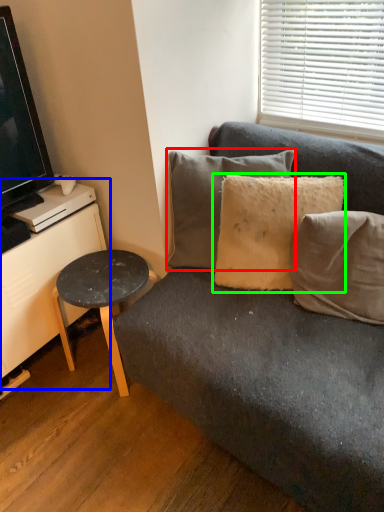
Question: Considering the real-world distances, which object is farthest from pillow (highlighted by a red box)? dresser (highlighted by a blue box) or pillow (highlighted by a green box)?

Choices:
 (A) dresser
 (B) pillow

Answer: (A)